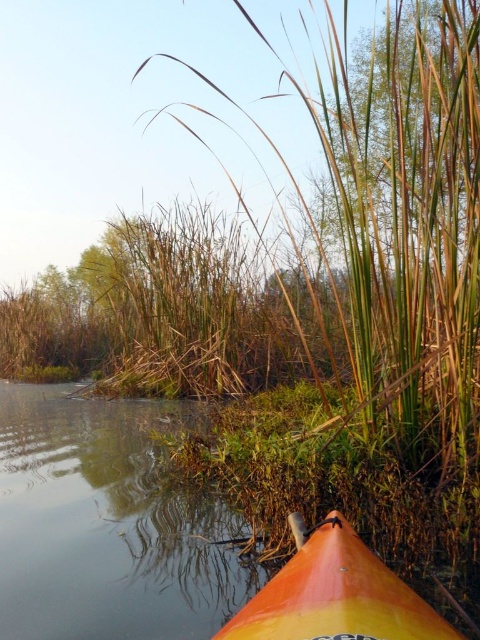
Question: Which point is farther from the camera taking this photo?

Choices:
 (A) (301, 529)
 (B) (175, 410)

Answer: (B)

Question: Can you confirm if smooth orange kayak at lower right is positioned to the right of orange/yellow plastic canoe at lower center?

Choices:
 (A) yes
 (B) no

Answer: (B)

Question: Among these points, which one is farthest from the camera?

Choices:
 (A) tap(132, 636)
 (B) tap(344, 628)

Answer: (A)

Question: Considering the relative positions of smooth orange kayak at lower right and orange/yellow plastic canoe at lower center in the image provided, where is smooth orange kayak at lower right located with respect to orange/yellow plastic canoe at lower center?

Choices:
 (A) left
 (B) right

Answer: (A)

Question: Which point appears farthest from the camera in this image?

Choices:
 (A) (315, 579)
 (B) (229, 605)

Answer: (B)

Question: Can you confirm if smooth orange kayak at lower right is thinner than orange/yellow plastic canoe at lower center?

Choices:
 (A) no
 (B) yes

Answer: (A)